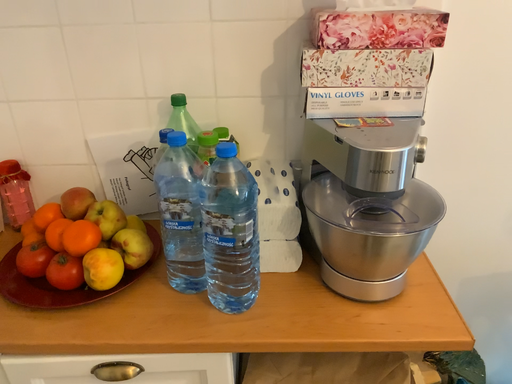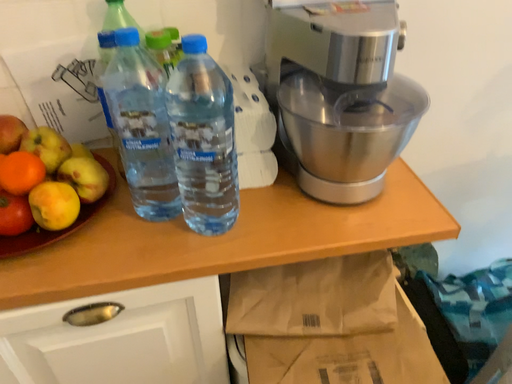
Question: Which way did the camera rotate in the video?

Choices:
 (A) rotated right
 (B) rotated left

Answer: (A)